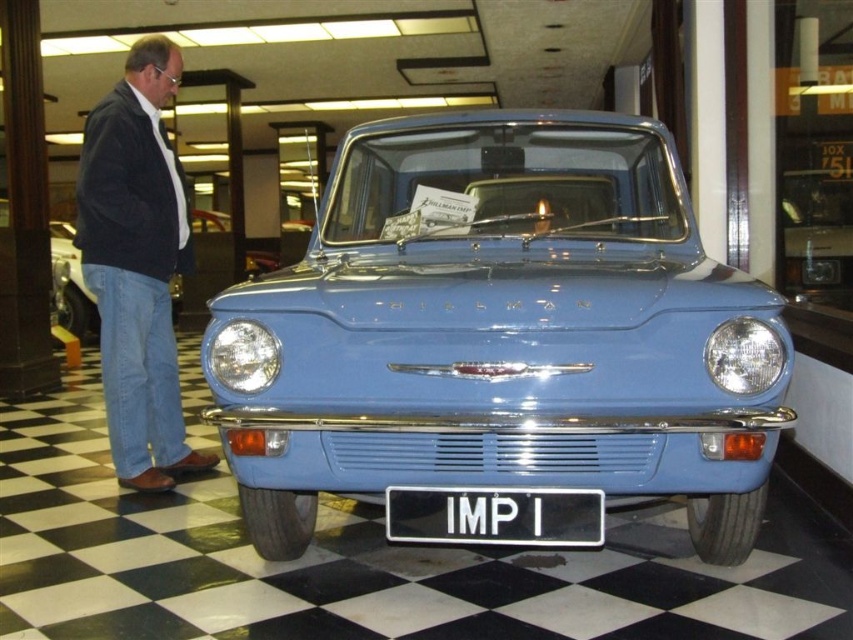
Question: Can you confirm if light blue glossy car at center is smaller than denim jeans at left?

Choices:
 (A) yes
 (B) no

Answer: (B)

Question: Can you confirm if light blue glossy car at center is wider than denim jeans at left?

Choices:
 (A) no
 (B) yes

Answer: (B)

Question: Which point is closer to the camera?

Choices:
 (A) black plastic license plate at center
 (B) light blue glossy car at center
 (C) denim jeans at left
 (D) matte blue car at left

Answer: (A)

Question: Is denim jeans at left closer to the viewer compared to black plastic license plate at center?

Choices:
 (A) no
 (B) yes

Answer: (A)

Question: Estimate the real-world distances between objects in this image. Which object is closer to the matte blue car at left?

Choices:
 (A) denim jeans at left
 (B) light blue glossy car at center
 (C) black plastic license plate at center

Answer: (A)

Question: Estimate the real-world distances between objects in this image. Which object is farther from the matte blue car at left?

Choices:
 (A) denim jeans at left
 (B) light blue glossy car at center

Answer: (B)